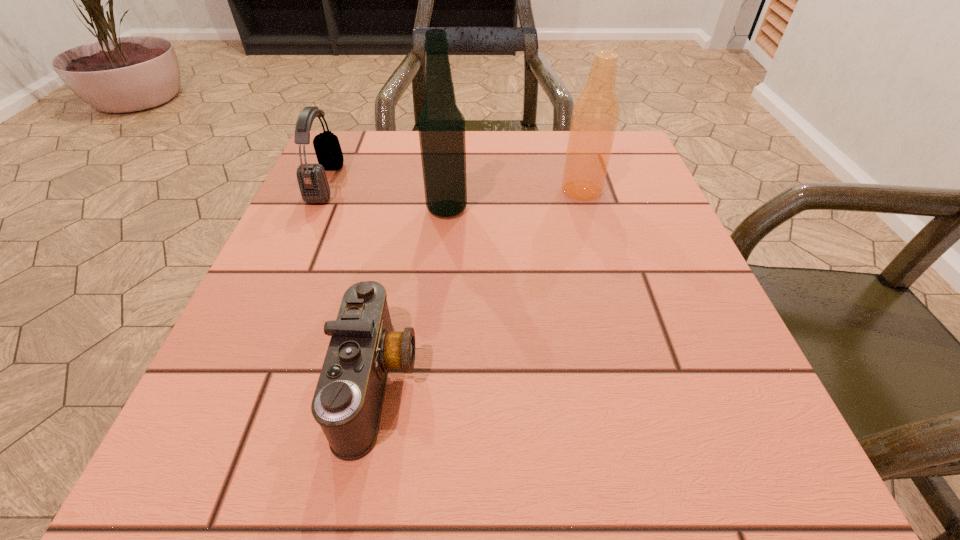
In the image, there is a desktop. Find the location of `blank space at the right edge`. blank space at the right edge is located at coordinates (648, 207).

Find the location of a particular element. This screenshot has height=540, width=960. free point at the near left corner is located at coordinates (262, 502).

In the image, there is a desktop. What are the coordinates of `free region at the far right corner` in the screenshot? It's located at (628, 154).

This screenshot has width=960, height=540. Identify the location of unoccupied area between the nearest object and the headset. (351, 282).

Where is `free spot between the headset and the tallest object`? free spot between the headset and the tallest object is located at coordinates (386, 195).

This screenshot has height=540, width=960. Find the location of `vacant region between the headset and the camera`. vacant region between the headset and the camera is located at coordinates (351, 282).

The image size is (960, 540). In order to click on vacant space in between the third tallest object and the alcohol in this screenshot , I will do `click(386, 195)`.

Find the location of `free space between the nearest object and the second tallest object`. free space between the nearest object and the second tallest object is located at coordinates (479, 286).

Find the location of a particular element. Image resolution: width=960 pixels, height=540 pixels. free space that is in between the third tallest object and the alcohol is located at coordinates (386, 195).

At what (x,y) coordinates should I click in order to perform the action: click on empty space that is in between the alcohol and the headset. Please return your answer as a coordinate pair (x, y). Image resolution: width=960 pixels, height=540 pixels. Looking at the image, I should click on 386,195.